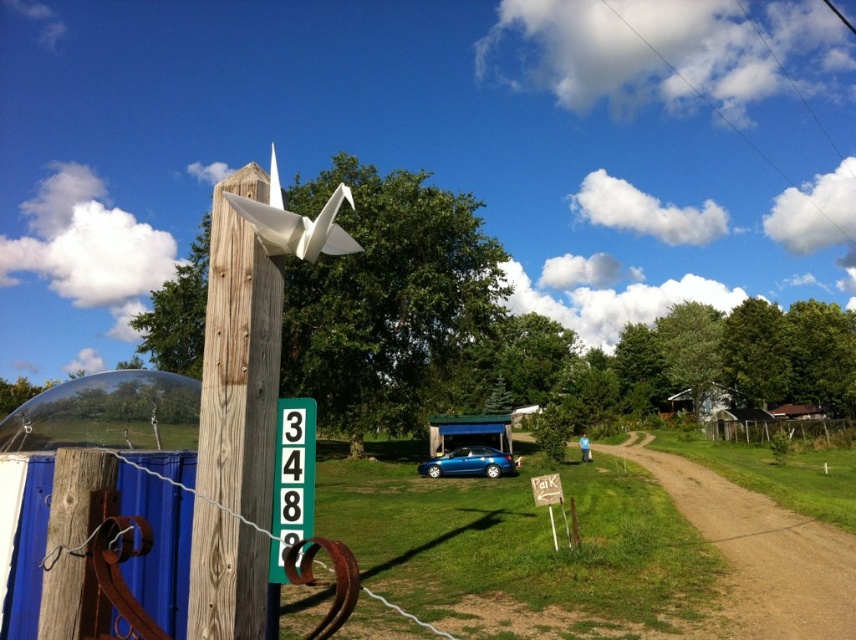
Question: Which of the following is the farthest from the observer?

Choices:
 (A) (829, 589)
 (B) (242, 461)

Answer: (A)

Question: From the image, what is the correct spatial relationship of wooden post at left in relation to green painted wooden sign at center-left?

Choices:
 (A) above
 (B) below

Answer: (B)

Question: Does brown dirt track at lower right have a smaller size compared to white paper crane at upper center?

Choices:
 (A) yes
 (B) no

Answer: (A)

Question: Which object is farther from the camera taking this photo?

Choices:
 (A) wooden post at left
 (B) metallic blue car at center
 (C) white paper crane at upper center

Answer: (B)

Question: Can you confirm if green painted wooden sign at center-left is bigger than white paper crane at upper center?

Choices:
 (A) yes
 (B) no

Answer: (B)

Question: Considering the real-world distances, which object is closest to the white paper crane at upper center?

Choices:
 (A) wooden post at left
 (B) green painted wooden sign at center-left
 (C) metallic blue car at center

Answer: (A)